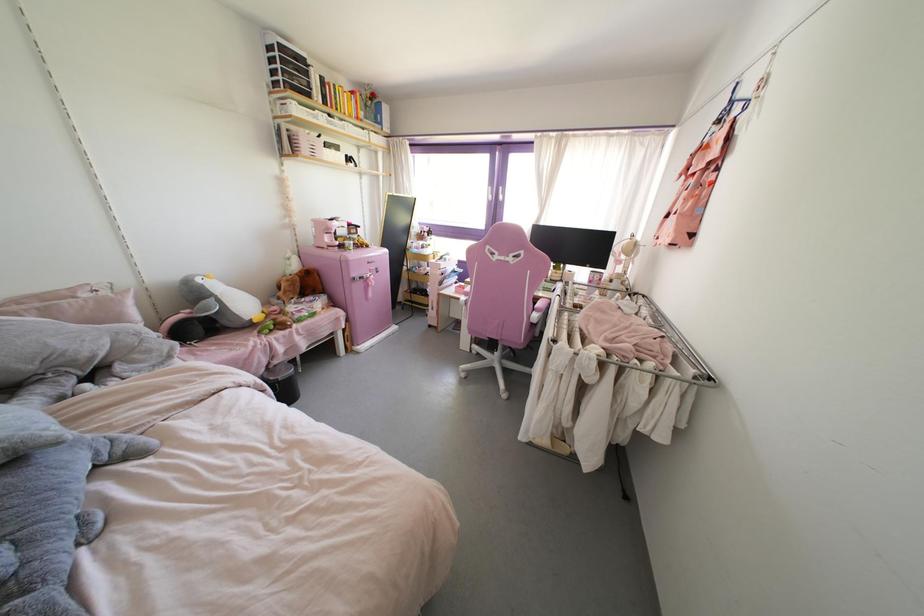
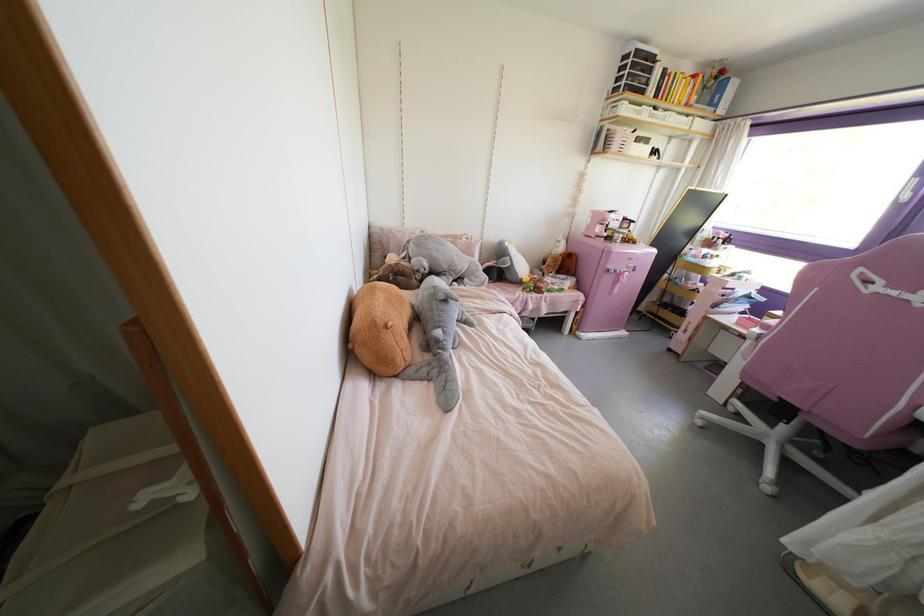
Find the pixel in the second image that matches (431,256) in the first image.

(713, 270)